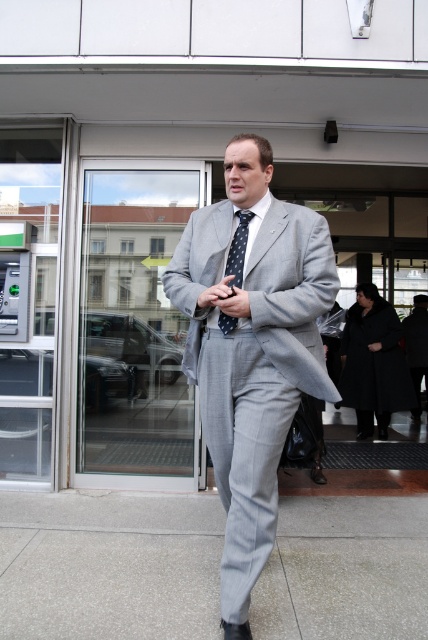
You are standing at the entrance of the modern building and see the gray concrete pavement at lower center and the gray pinstripe suit at center. Which object is positioned to the left of the other?

The gray concrete pavement at lower center is to the left of the gray pinstripe suit at center according to the description.

You are standing at the point marked by the coordinates point (x=109, y=564) in the image. What is the material of the surface you are currently standing on?

The point (x=109, y=564) indicates gray concrete pavement at lower center.